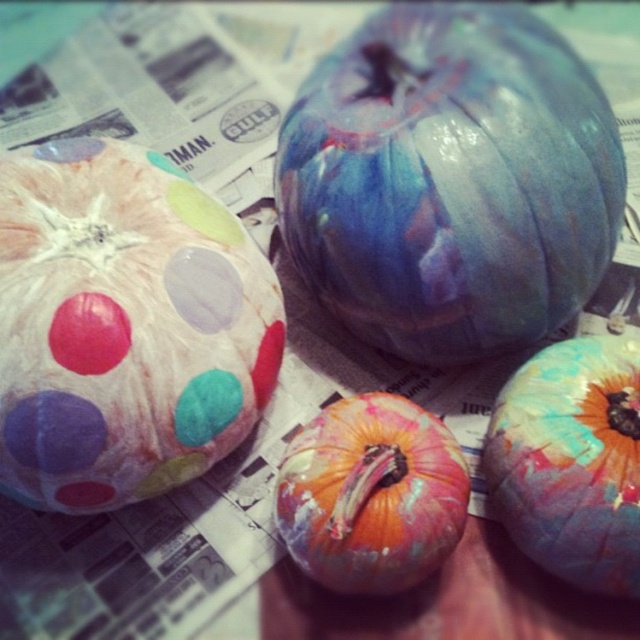
Question: Does multicolored painted pumpkin at lower right appear under multicolored painted pumpkin at center?

Choices:
 (A) yes
 (B) no

Answer: (A)

Question: Which object is positioned closest to the multicolored painted pumpkin at center?

Choices:
 (A) marbled blue pumpkin at center
 (B) multicolored painted pumpkin at lower right

Answer: (B)

Question: Which point appears closest to the camera in this image?

Choices:
 (A) (396, 548)
 (B) (630, 573)
 (C) (52, 372)

Answer: (C)

Question: Considering the relative positions of marbled blue pumpkin at center and multicolored painted pumpkin at lower right in the image provided, where is marbled blue pumpkin at center located with respect to multicolored painted pumpkin at lower right?

Choices:
 (A) left
 (B) right

Answer: (A)

Question: Among these objects, which one is farthest from the camera?

Choices:
 (A) polka-dotted pumpkin at upper left
 (B) multicolored painted pumpkin at lower right

Answer: (B)

Question: Does marbled blue pumpkin at center appear over multicolored painted pumpkin at center?

Choices:
 (A) yes
 (B) no

Answer: (A)